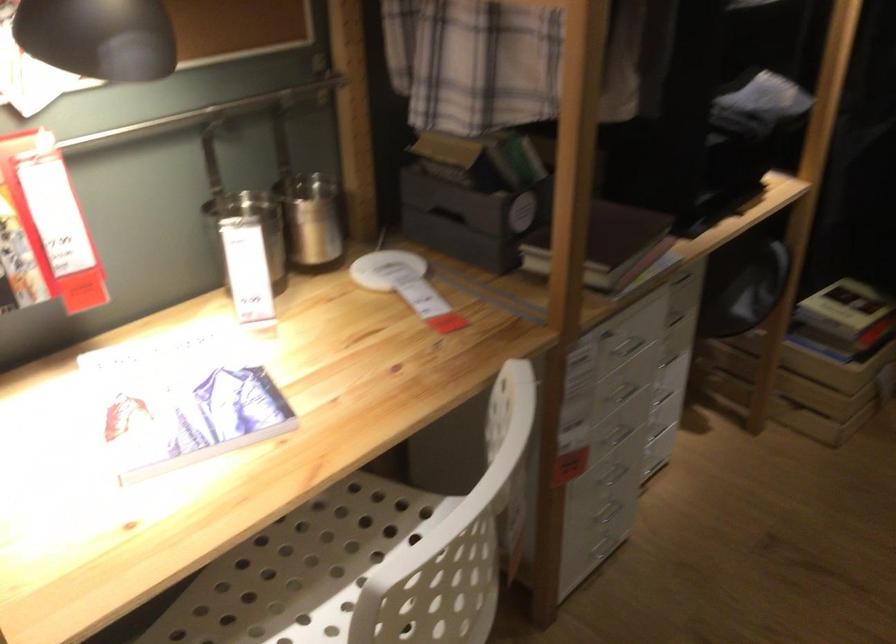
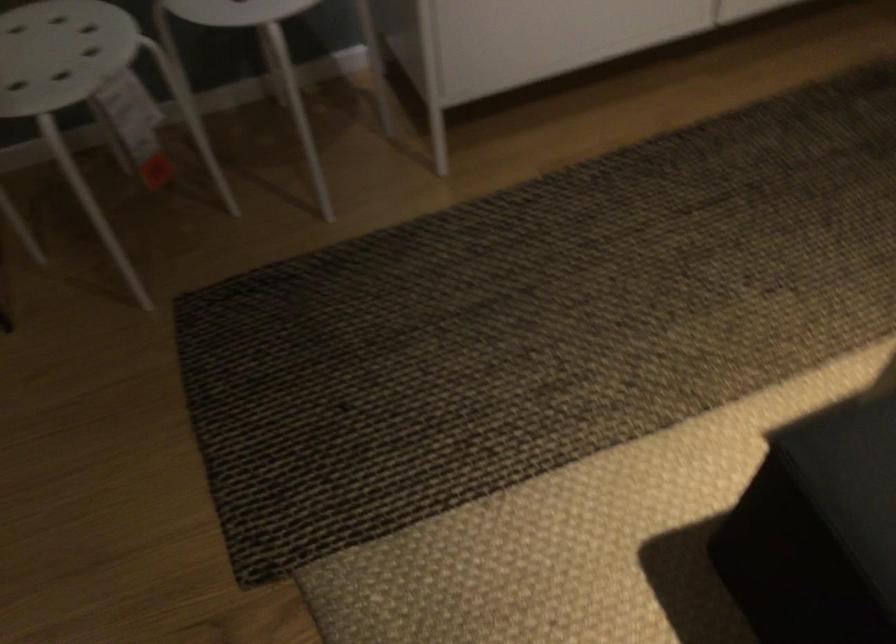
The first image is from the beginning of the video and the second image is from the end. How did the camera likely rotate when shooting the video?

The rotation direction of the camera is right-down.